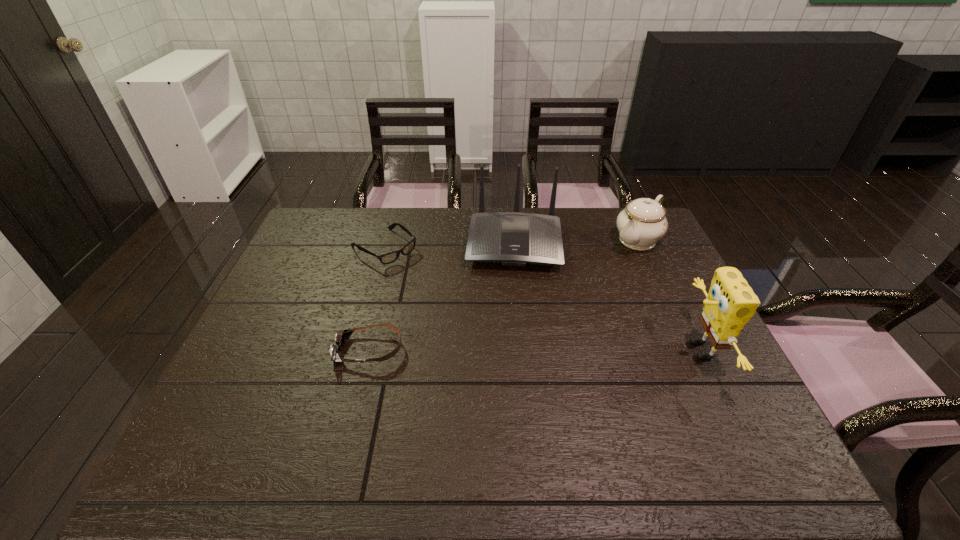
Identify the location of vacant space positioned on the face of the sponge. (552, 350).

Locate an element on the screen. free location located on the front-facing side of the router is located at coordinates (513, 289).

The height and width of the screenshot is (540, 960). In order to click on vacant space situated 0.060m on the front-facing side of the router in this screenshot , I will do `click(513, 287)`.

This screenshot has width=960, height=540. What are the coordinates of `free spot located 0.160m on the front-facing side of the router` in the screenshot? It's located at (512, 311).

This screenshot has width=960, height=540. In order to click on vacant space located at the spout of the third tallest object in this screenshot , I will do `click(596, 278)`.

Locate an element on the screen. vacant region located 0.190m at the spout of the third tallest object is located at coordinates (592, 281).

Image resolution: width=960 pixels, height=540 pixels. In order to click on vacant space located at the spout of the third tallest object in this screenshot , I will do `click(612, 264)`.

You are a GUI agent. You are given a task and a screenshot of the screen. Output one action in this format:
    pyautogui.click(x=<x>, y=<y>)
    Task: Click on the free space located 0.300m on the front-facing side of the spectacles
    The width and height of the screenshot is (960, 540).
    Given the screenshot: What is the action you would take?
    pyautogui.click(x=468, y=313)

Find the location of a particular element. The image size is (960, 540). vacant area situated on the front-facing side of the spectacles is located at coordinates (430, 284).

You are a GUI agent. You are given a task and a screenshot of the screen. Output one action in this format:
    pyautogui.click(x=<x>, y=<y>)
    Task: Click on the vacant space located 0.240m on the front-facing side of the spectacles
    The image size is (960, 540).
    Given the screenshot: What is the action you would take?
    pyautogui.click(x=455, y=302)